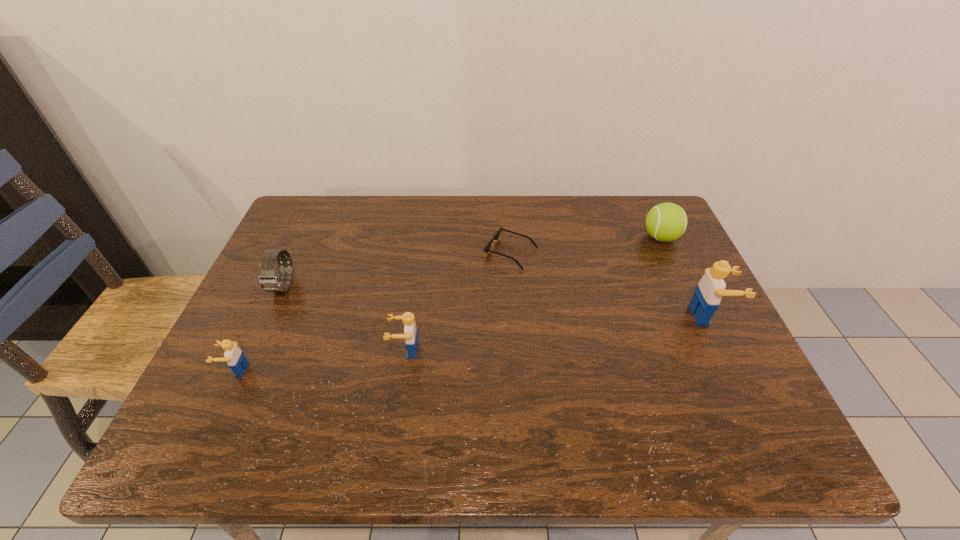
Locate an element on the screen. Image resolution: width=960 pixels, height=540 pixels. vacant space at the far left corner of the desktop is located at coordinates (292, 236).

Where is `vacant region at the near right corner of the desktop`? Image resolution: width=960 pixels, height=540 pixels. vacant region at the near right corner of the desktop is located at coordinates (757, 397).

Identify the location of vacant area that lies between the shortest object and the second tallest Lego. The height and width of the screenshot is (540, 960). click(458, 301).

Identify the location of free space between the watch and the shortest Lego. (259, 328).

Locate an element on the screen. This screenshot has height=540, width=960. empty space that is in between the leftmost Lego and the second Lego from right to left is located at coordinates (321, 360).

Locate an element on the screen. vacant area that lies between the tennis ball and the watch is located at coordinates (472, 262).

This screenshot has width=960, height=540. I want to click on vacant space that is in between the fourth object from right to left and the watch, so click(345, 319).

This screenshot has width=960, height=540. I want to click on empty space between the leftmost Lego and the tallest Lego, so click(472, 342).

Where is `free spot between the second Lego from right to left and the sunglasses`? The width and height of the screenshot is (960, 540). free spot between the second Lego from right to left and the sunglasses is located at coordinates (458, 301).

Locate an element on the screen. The image size is (960, 540). vacant space that's between the watch and the tennis ball is located at coordinates (472, 262).